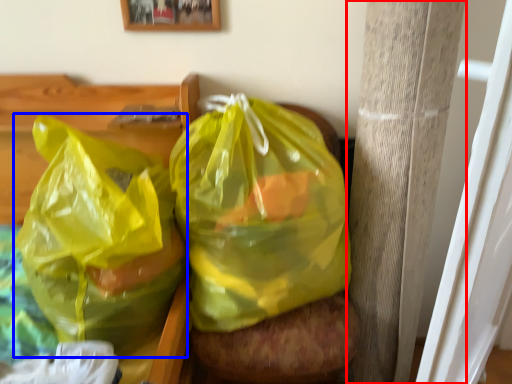
Question: Among these objects, which one is farthest to the camera, pillar (highlighted by a red box) or plastic bag (highlighted by a blue box)?

Choices:
 (A) pillar
 (B) plastic bag

Answer: (A)